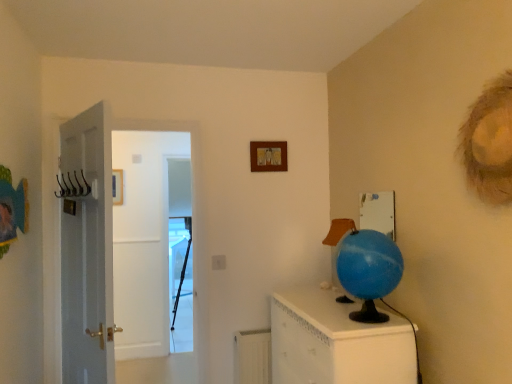
Question: Does metallic wire hanger at left appear on the left side of white plastic radiator at lower center?

Choices:
 (A) yes
 (B) no

Answer: (A)

Question: Can you see metallic wire hanger at left touching white plastic radiator at lower center?

Choices:
 (A) yes
 (B) no

Answer: (B)

Question: Is metallic wire hanger at left shorter than white plastic radiator at lower center?

Choices:
 (A) yes
 (B) no

Answer: (A)

Question: Can you confirm if metallic wire hanger at left is wider than white plastic radiator at lower center?

Choices:
 (A) yes
 (B) no

Answer: (A)

Question: From the image's perspective, is metallic wire hanger at left on top of white plastic radiator at lower center?

Choices:
 (A) no
 (B) yes

Answer: (B)

Question: Does metallic wire hanger at left appear on the right side of white plastic radiator at lower center?

Choices:
 (A) yes
 (B) no

Answer: (B)

Question: Is blue rubber globe at right to the left of metallic wire hanger at left from the viewer's perspective?

Choices:
 (A) yes
 (B) no

Answer: (B)

Question: Does blue rubber globe at right contain metallic wire hanger at left?

Choices:
 (A) yes
 (B) no

Answer: (B)

Question: From the image's perspective, is blue rubber globe at right located beneath metallic wire hanger at left?

Choices:
 (A) no
 (B) yes

Answer: (B)

Question: Considering the relative sizes of blue rubber globe at right and metallic wire hanger at left in the image provided, is blue rubber globe at right thinner than metallic wire hanger at left?

Choices:
 (A) yes
 (B) no

Answer: (A)

Question: Is blue rubber globe at right further to the viewer compared to metallic wire hanger at left?

Choices:
 (A) no
 (B) yes

Answer: (B)

Question: Considering the relative sizes of blue rubber globe at right and metallic wire hanger at left in the image provided, is blue rubber globe at right smaller than metallic wire hanger at left?

Choices:
 (A) yes
 (B) no

Answer: (B)

Question: Considering the relative sizes of white plastic radiator at lower center and wooden picture frame at upper center in the image provided, is white plastic radiator at lower center thinner than wooden picture frame at upper center?

Choices:
 (A) yes
 (B) no

Answer: (B)